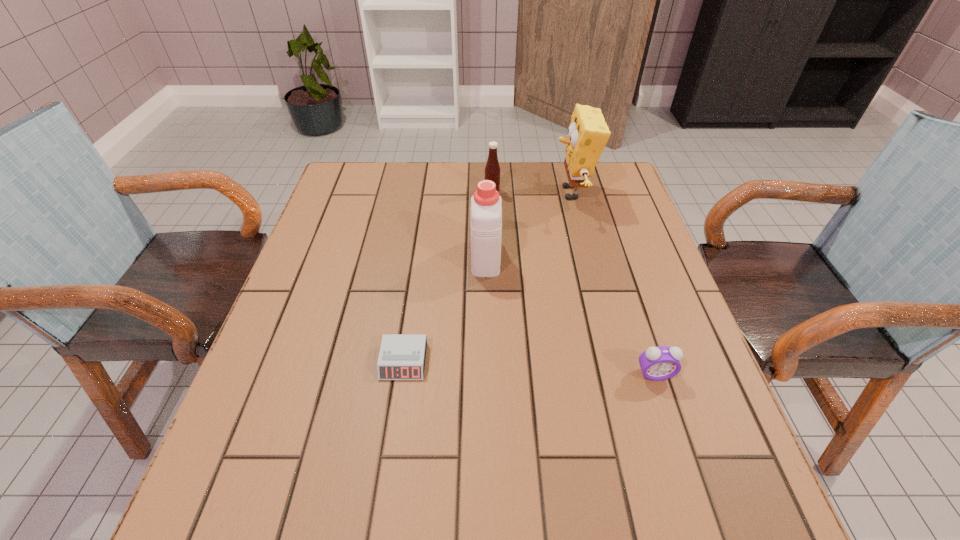
This screenshot has height=540, width=960. What are the coordinates of `vacant area that lies between the right alarm clock and the Tabasco sauce` in the screenshot? It's located at (573, 282).

I want to click on empty location between the sponge and the taller alarm clock, so click(x=613, y=284).

Find the location of a particular element. The width and height of the screenshot is (960, 540). blank region between the shorter alarm clock and the Tabasco sauce is located at coordinates (448, 276).

In order to click on unoccupied position between the shorter alarm clock and the second shortest object in this screenshot , I will do `click(529, 368)`.

Identify the location of object that can be found as the second closest to the fourth tallest object. The height and width of the screenshot is (540, 960). (402, 356).

The width and height of the screenshot is (960, 540). What are the coordinates of `object that stands as the closest to the sponge` in the screenshot? It's located at (492, 169).

Where is `vacant region that satisfies the following two spatial constraints: 1. on the face of the sponge; 2. on the front side of the left alarm clock`? The height and width of the screenshot is (540, 960). vacant region that satisfies the following two spatial constraints: 1. on the face of the sponge; 2. on the front side of the left alarm clock is located at coordinates (614, 361).